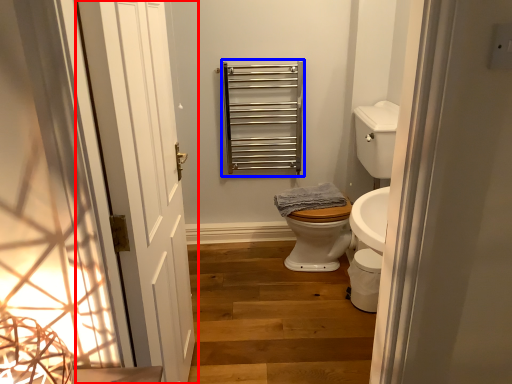
Question: Which object appears closest to the camera in this image, door (highlighted by a red box) or balustrade (highlighted by a blue box)?

Choices:
 (A) door
 (B) balustrade

Answer: (A)